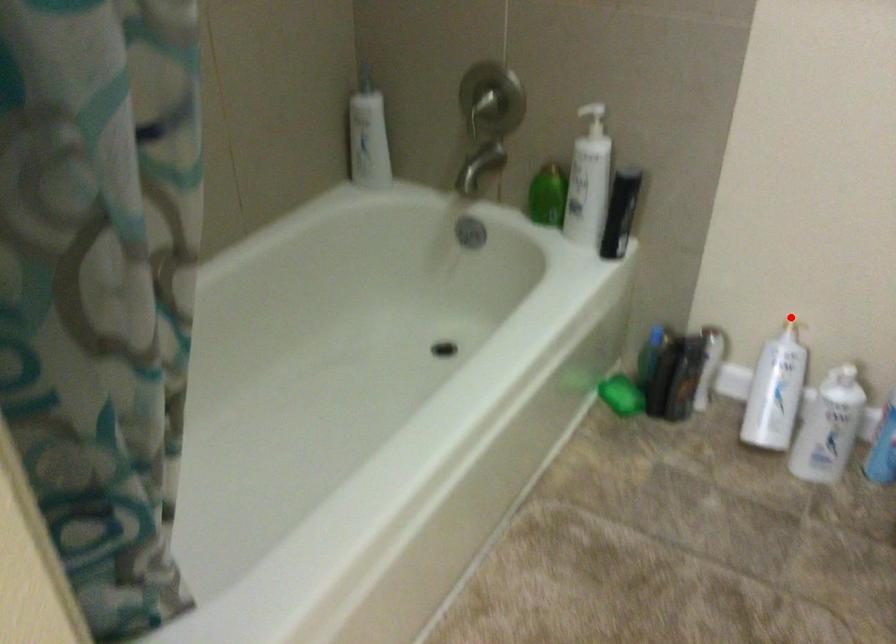
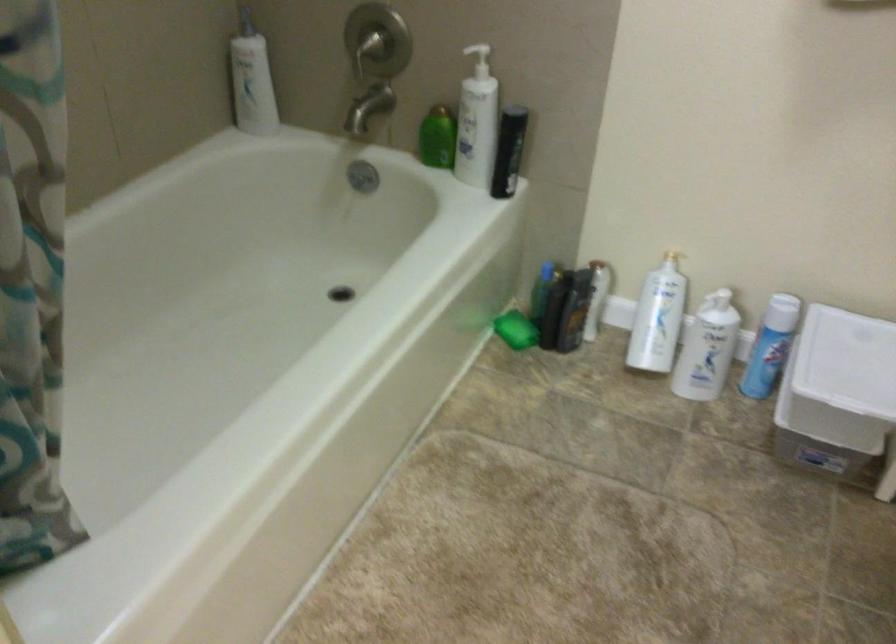
Find the pixel in the second image that matches the highlighted location in the first image.

(672, 249)